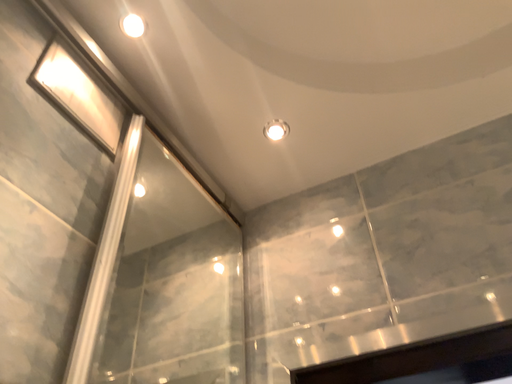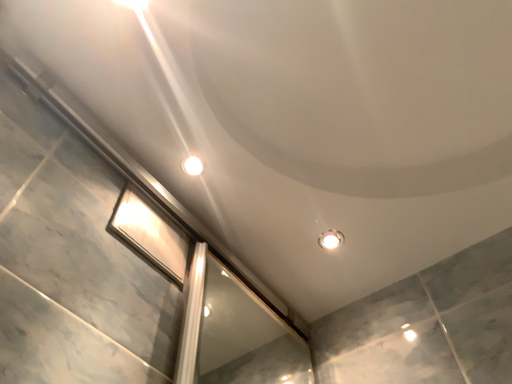
Question: Which way did the camera rotate in the video?

Choices:
 (A) rotated right
 (B) rotated left

Answer: (B)